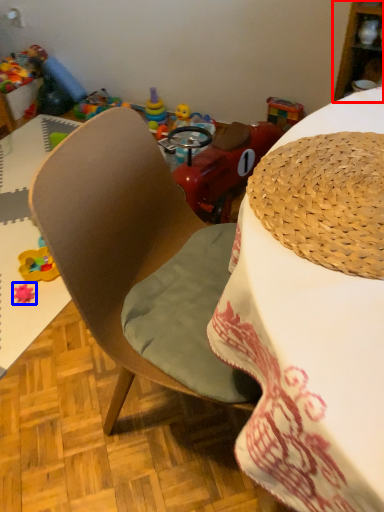
Question: Among these objects, which one is farthest to the camera, cabinetry (highlighted by a red box) or toy (highlighted by a blue box)?

Choices:
 (A) cabinetry
 (B) toy

Answer: (B)